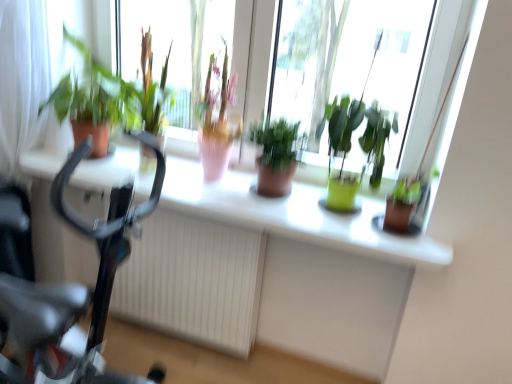
The image size is (512, 384). What do you see at coordinates (73, 292) in the screenshot?
I see `black glossy bicycle at left` at bounding box center [73, 292].

Describe the element at coordinates (276, 156) in the screenshot. I see `matte brown pot at center, the 3th houseplant from the right` at that location.

This screenshot has width=512, height=384. Describe the element at coordinates (407, 206) in the screenshot. I see `green matte pot at right, which ranks as the 4th houseplant in left-to-right order` at that location.

The width and height of the screenshot is (512, 384). Find the location of `green matte pot at right, which ranks as the 4th houseplant in left-to-right order`. green matte pot at right, which ranks as the 4th houseplant in left-to-right order is located at coordinates (407, 206).

Where is `white textured radiator at center`? white textured radiator at center is located at coordinates (194, 281).

How many degrees apart are the facing directions of matte white computer desk at center and green matte pot at right, which ranks as the 4th houseplant in left-to-right order?

The angle between the facing direction of matte white computer desk at center and the facing direction of green matte pot at right, which ranks as the 4th houseplant in left-to-right order, is 91.2 degrees.

Is matte white computer desk at center far from green matte pot at right, the 1th houseplant viewed from the right?

No, matte white computer desk at center is not far away from green matte pot at right, the 1th houseplant viewed from the right.

Would you say green matte pot at right, the 1th houseplant viewed from the right, is part of matte white computer desk at center's contents?

Actually, green matte pot at right, the 1th houseplant viewed from the right, is outside matte white computer desk at center.

From a real-world perspective, relative to green matte pot at right, the 1th houseplant viewed from the right, is matte white computer desk at center vertically above or below?

matte white computer desk at center is below green matte pot at right, the 1th houseplant viewed from the right.

Based on the photo, in terms of width, does green matte plant at left, arranged as the 1th houseplant when viewed from the left, look wider or thinner when compared to green glossy plant at center, the second houseplant in the right-to-left sequence?

Considering their sizes, green matte plant at left, arranged as the 1th houseplant when viewed from the left, looks broader than green glossy plant at center, the second houseplant in the right-to-left sequence.

Is green matte plant at left, the fourth houseplant positioned from the right, smaller than green glossy plant at center, which is the third houseplant in left-to-right order?

Incorrect, green matte plant at left, the fourth houseplant positioned from the right, is not smaller in size than green glossy plant at center, which is the third houseplant in left-to-right order.

From the picture: In terms of height, does green matte plant at left, the fourth houseplant positioned from the right, look taller or shorter compared to green glossy plant at center, the second houseplant in the right-to-left sequence?

In the image, green matte plant at left, the fourth houseplant positioned from the right, appears to be taller than green glossy plant at center, the second houseplant in the right-to-left sequence.

Is green matte plant at left, the fourth houseplant positioned from the right, to the right of green glossy plant at center, which is the third houseplant in left-to-right order, from the viewer's perspective?

No, green matte plant at left, the fourth houseplant positioned from the right, is not to the right of green glossy plant at center, which is the third houseplant in left-to-right order.

Which of these two, green matte pot at right, the 1th houseplant viewed from the right, or black glossy bicycle at left, is bigger?

With larger size is black glossy bicycle at left.

Choose the correct answer: Is green matte pot at right, which ranks as the 4th houseplant in left-to-right order, inside black glossy bicycle at left or outside it?

green matte pot at right, which ranks as the 4th houseplant in left-to-right order, is not inside black glossy bicycle at left, it's outside.

From a real-world perspective, is green matte pot at right, the 1th houseplant viewed from the right, physically located above or below black glossy bicycle at left?

In terms of real-world spatial position, green matte pot at right, the 1th houseplant viewed from the right, is above black glossy bicycle at left.

Is green matte pot at right, the 1th houseplant viewed from the right, at the right side of black glossy bicycle at left?

Yes, green matte pot at right, the 1th houseplant viewed from the right, is to the right of black glossy bicycle at left.

From a real-world perspective, count 3rd houseplants upward from the white textured radiator at center and point to it. Please provide its 2D coordinates.

[(350, 146)]

Can we say white textured radiator at center lies outside green glossy plant at center, the second houseplant in the right-to-left sequence?

Indeed, white textured radiator at center is completely outside green glossy plant at center, the second houseplant in the right-to-left sequence.

Would you say white textured radiator at center is a long distance from green glossy plant at center, the second houseplant in the right-to-left sequence?

That's not correct — white textured radiator at center is a little close to green glossy plant at center, the second houseplant in the right-to-left sequence.

From the image's perspective, is matte brown pot at center, the 3th houseplant from the right, above green glossy plant at center, which is the third houseplant in left-to-right order?

Actually, matte brown pot at center, the 3th houseplant from the right, appears below green glossy plant at center, which is the third houseplant in left-to-right order, in the image.

Is matte brown pot at center, marked as the 2th houseplant in a left-to-right arrangement, at the right side of green glossy plant at center, the second houseplant in the right-to-left sequence?

In fact, matte brown pot at center, marked as the 2th houseplant in a left-to-right arrangement, is to the left of green glossy plant at center, the second houseplant in the right-to-left sequence.

Can we say matte brown pot at center, marked as the 2th houseplant in a left-to-right arrangement, lies outside green glossy plant at center, which is the third houseplant in left-to-right order?

Yes, matte brown pot at center, marked as the 2th houseplant in a left-to-right arrangement, is located beyond the bounds of green glossy plant at center, which is the third houseplant in left-to-right order.

From a real-world perspective, who is located lower, matte brown pot at center, the 3th houseplant from the right, or green glossy plant at center, which is the third houseplant in left-to-right order?

In real-world perspective, matte brown pot at center, the 3th houseplant from the right, is lower.

Does green matte pot at right, the 1th houseplant viewed from the right, come behind green matte plant at left, arranged as the 1th houseplant when viewed from the left?

No.

Is green matte plant at left, the fourth houseplant positioned from the right, surrounded by green matte pot at right, the 1th houseplant viewed from the right?

Definitely not — green matte plant at left, the fourth houseplant positioned from the right, is not inside green matte pot at right, the 1th houseplant viewed from the right.

From a real-world perspective, is green matte pot at right, which ranks as the 4th houseplant in left-to-right order, located higher than green matte plant at left, the fourth houseplant positioned from the right?

Actually, green matte pot at right, which ranks as the 4th houseplant in left-to-right order, is physically below green matte plant at left, the fourth houseplant positioned from the right, in the real world.

Is green matte plant at upper center in front of matte brown pot at center, the 3th houseplant from the right?

Yes, the depth of green matte plant at upper center is less than that of matte brown pot at center, the 3th houseplant from the right.

Would you say green matte plant at upper center contains matte brown pot at center, the 3th houseplant from the right?

No, matte brown pot at center, the 3th houseplant from the right, is not surrounded by green matte plant at upper center.

Is green matte plant at upper center bigger than matte brown pot at center, marked as the 2th houseplant in a left-to-right arrangement?

Yes.

Considering the sizes of objects green matte plant at upper center and matte brown pot at center, marked as the 2th houseplant in a left-to-right arrangement, in the image provided, who is shorter, green matte plant at upper center or matte brown pot at center, marked as the 2th houseplant in a left-to-right arrangement,?

Standing shorter between the two is matte brown pot at center, marked as the 2th houseplant in a left-to-right arrangement.

Where is `computer desk on the left of the green matte pot at right, the 1th houseplant viewed from the right`? computer desk on the left of the green matte pot at right, the 1th houseplant viewed from the right is located at coordinates (271, 271).

Locate an element on the screen. The image size is (512, 384). houseplant lying above the green glossy plant at center, the second houseplant in the right-to-left sequence (from the image's perspective) is located at coordinates (94, 101).

Based on their spatial positions, is green matte plant at left, the fourth houseplant positioned from the right, or green matte plant at upper center further from green glossy plant at center, the second houseplant in the right-to-left sequence?

green matte plant at left, the fourth houseplant positioned from the right.

Estimate the real-world distances between objects in this image. Which object is closer to matte white computer desk at center, green matte pot at right, the 1th houseplant viewed from the right, or black glossy bicycle at left?

black glossy bicycle at left is positioned closer to the anchor matte white computer desk at center.

Estimate the real-world distances between objects in this image. Which object is further from green matte plant at upper center, matte white computer desk at center or matte brown pot at center, the 3th houseplant from the right?

matte white computer desk at center is positioned further to the anchor green matte plant at upper center.

Looking at the image, which one is located closer to green matte pot at right, which ranks as the 4th houseplant in left-to-right order, green glossy plant at center, the second houseplant in the right-to-left sequence, or green matte plant at upper center?

Based on the image, green glossy plant at center, the second houseplant in the right-to-left sequence, appears to be nearer to green matte pot at right, which ranks as the 4th houseplant in left-to-right order.

When comparing their distances from green glossy plant at center, which is the third houseplant in left-to-right order, does green matte pot at right, which ranks as the 4th houseplant in left-to-right order, or black glossy bicycle at left seem closer?

green matte pot at right, which ranks as the 4th houseplant in left-to-right order, is positioned closer to the anchor green glossy plant at center, which is the third houseplant in left-to-right order.

Considering their positions, is matte brown pot at center, the 3th houseplant from the right, positioned further to matte white computer desk at center than white textured radiator at center?

matte brown pot at center, the 3th houseplant from the right.

Looking at the image, which one is located further to matte brown pot at center, marked as the 2th houseplant in a left-to-right arrangement, green matte pot at right, the 1th houseplant viewed from the right, or green glossy plant at center, which is the third houseplant in left-to-right order?

The object further to matte brown pot at center, marked as the 2th houseplant in a left-to-right arrangement, is green matte pot at right, the 1th houseplant viewed from the right.

Looking at the image, which one is located further to white textured radiator at center, green matte pot at right, which ranks as the 4th houseplant in left-to-right order, or green glossy plant at center, which is the third houseplant in left-to-right order?

green matte pot at right, which ranks as the 4th houseplant in left-to-right order, is further to white textured radiator at center.

Find the location of a particular element. Image resolution: width=512 pixels, height=384 pixels. bay window situated between white textured radiator at center and green matte pot at right, which ranks as the 4th houseplant in left-to-right order, from left to right is located at coordinates (349, 60).

Locate an element on the screen. This screenshot has width=512, height=384. radiator between black glossy bicycle at left and green matte plant at upper center in the horizontal direction is located at coordinates (194, 281).

The image size is (512, 384). I want to click on bay window between white textured radiator at center and green glossy plant at center, the second houseplant in the right-to-left sequence, in the horizontal direction, so click(x=349, y=60).

The width and height of the screenshot is (512, 384). What are the coordinates of `bay window located between matte brown pot at center, marked as the 2th houseplant in a left-to-right arrangement, and green glossy plant at center, which is the third houseplant in left-to-right order, in the left-right direction` in the screenshot? It's located at (349, 60).